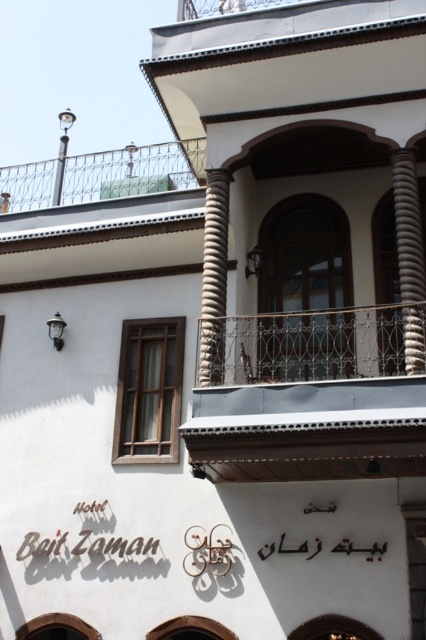
Does metallic polished balcony at center have a lesser height compared to sandy beige textured column at right?

Yes.

Is point (310, 321) positioned after point (399, 179)?

Yes, it is behind point (399, 179).

Find the location of a particular element. metallic polished balcony at center is located at coordinates (x=310, y=396).